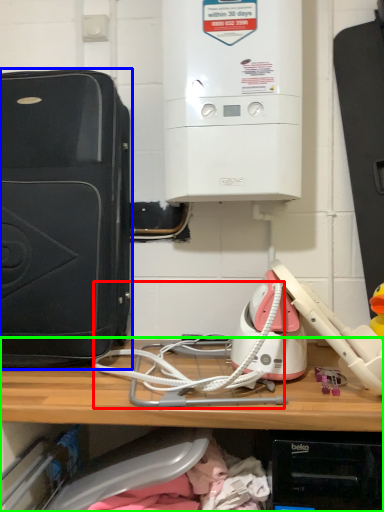
Question: Estimate the real-world distances between objects in this image. Which object is farther from wire (highlighted by a red box), home appliance (highlighted by a blue box) or shelf (highlighted by a green box)?

Choices:
 (A) home appliance
 (B) shelf

Answer: (A)